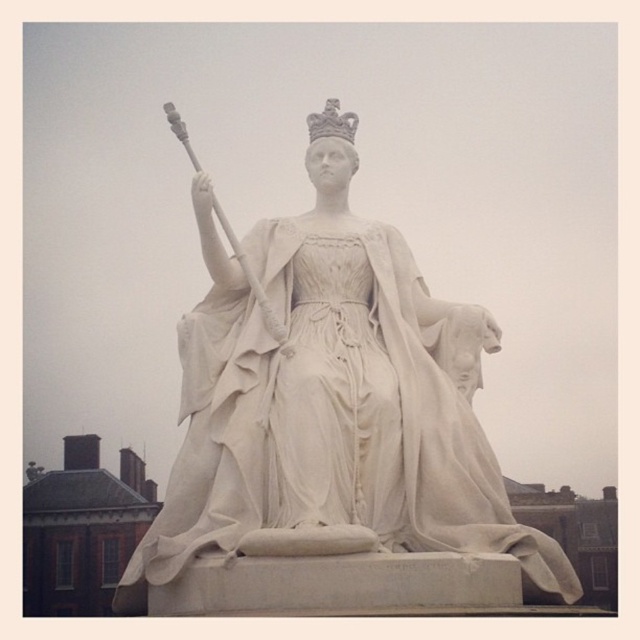
Who is taller, white marble statue at center or white stone crown at upper center?

white marble statue at center

Consider the image. Which is more to the left, white marble statue at center or white stone crown at upper center?

From the viewer's perspective, white stone crown at upper center appears more on the left side.

Is point (371, 444) farther from viewer compared to point (308, 116)?

No.

Locate an element on the screen. This screenshot has width=640, height=640. white marble statue at center is located at coordinates (332, 401).